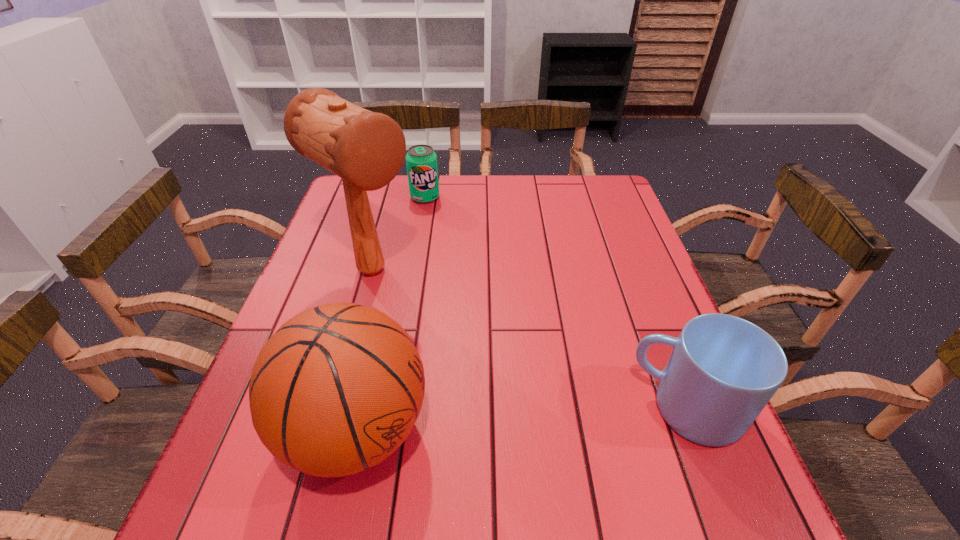
This screenshot has width=960, height=540. What are the coordinates of `vacant space on the desktop that is between the basketball and the rightmost object and is positioned on the strike surface of the mallet` in the screenshot? It's located at (567, 417).

Find the location of a particular element. free space on the desktop that is between the second tallest object and the rightmost object and is positioned on the front-facing side of the pop soda is located at coordinates (532, 419).